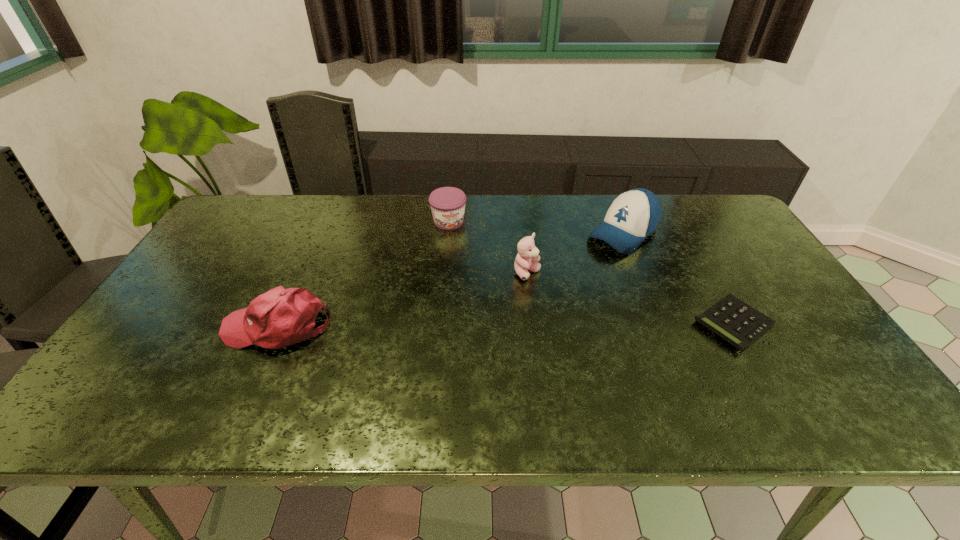
This screenshot has width=960, height=540. What are the coordinates of `vacant spot on the desktop that is between the leftmost object and the calculator and is positioned on the front label of the jam` in the screenshot? It's located at point(493,325).

Where is `free spot on the desktop that is between the nearer baseball cap and the shortest object and is positioned at the face of the third object from left to right`? The image size is (960, 540). free spot on the desktop that is between the nearer baseball cap and the shortest object and is positioned at the face of the third object from left to right is located at coordinates (573, 325).

The height and width of the screenshot is (540, 960). I want to click on free space on the desktop that is between the left baseball cap and the calculator and is positioned on the front-facing side of the right baseball cap, so click(x=509, y=325).